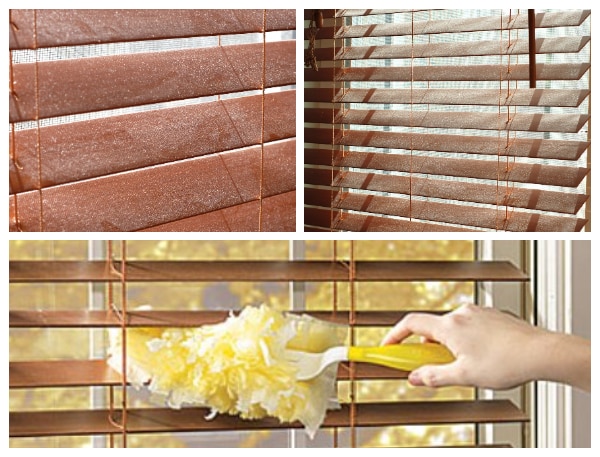
You are a GUI agent. You are given a task and a screenshot of the screen. Output one action in this format:
    pyautogui.click(x=<x>, y=<y>)
    Task: Click on the duster
    This screenshot has width=600, height=457.
    Given the screenshot: What is the action you would take?
    pyautogui.click(x=257, y=357)